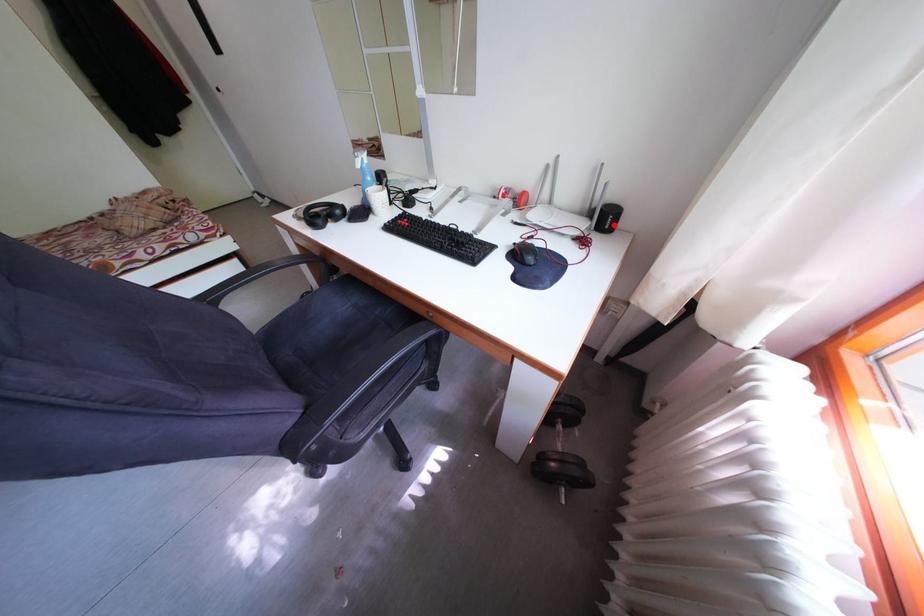
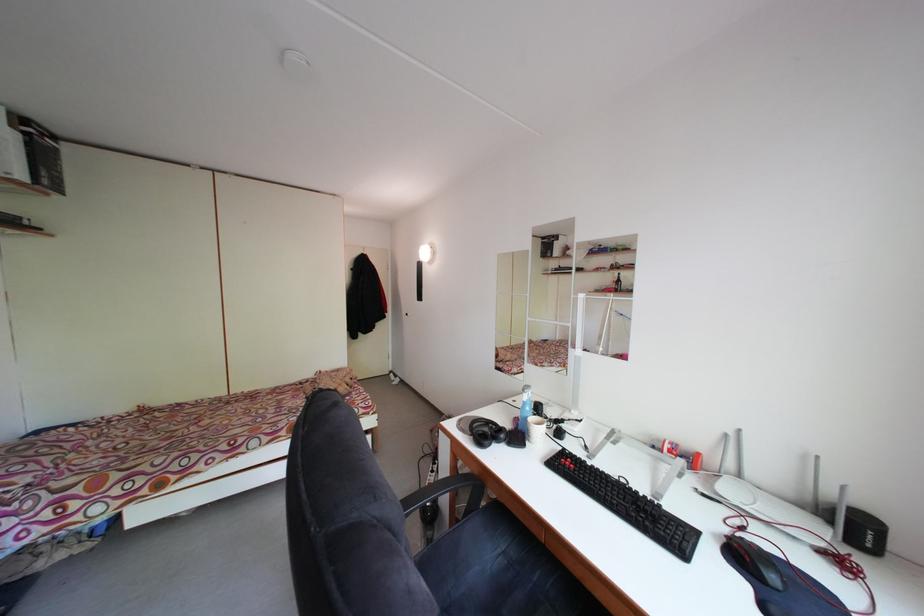
In the second image, find the point that corresponds to the highlighted location in the first image.

(865, 535)